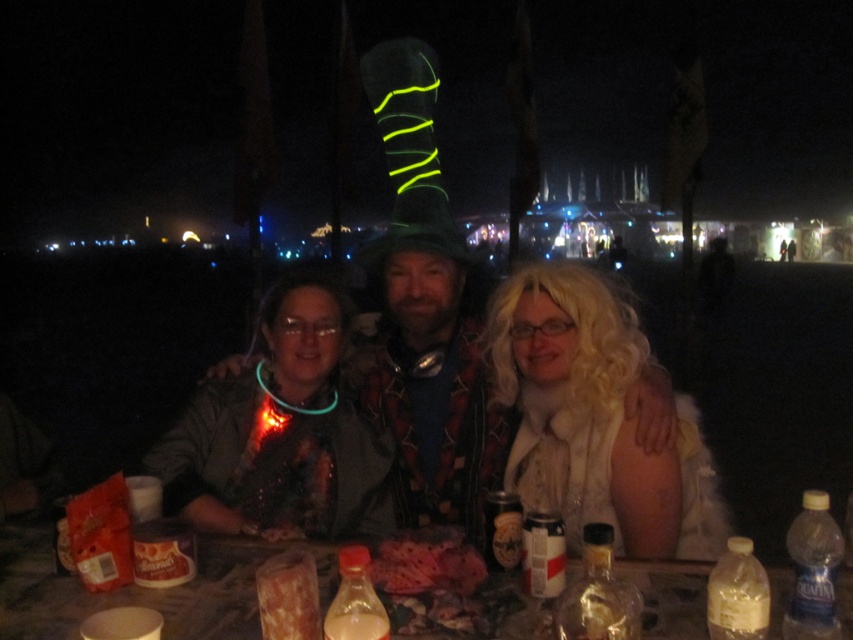
You are at a festival and want to store your metallic silver can at center and translucent plastic bag at lower center in a backpack compartment that can only hold items shorter than 20 cm. Based on the scene description, can both items fit?

The translucent plastic bag at lower center is shorter than the metallic silver can at center. However, since the metallic silver can at center is taller than the plastic bag, and the backpack compartment requires items shorter than 20 cm, we need to know the exact height of the can. Unfortunately, the scene description does not provide specific measurements for either item. Therefore, it is uncertain if both items will fit in the backpack compartment.

You are a photographer at the event and want to take a closeup of the white fluffy wig at center without moving the camera. Can you zoom in enough to capture the wig clearly?

The white fluffy wig at center is 5.68 feet away from the camera. Depending on the camera lens, if it has sufficient zoom capability to focus on objects at that distance, then yes, you can capture it clearly. However, if the zoom is limited, you might need to adjust settings or use a different lens.